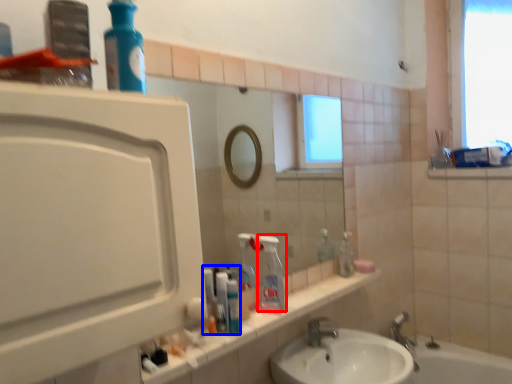
Question: Which of the following is the closest to the observer, cleaning product (highlighted by a red box) or toiletry (highlighted by a blue box)?

Choices:
 (A) cleaning product
 (B) toiletry

Answer: (B)